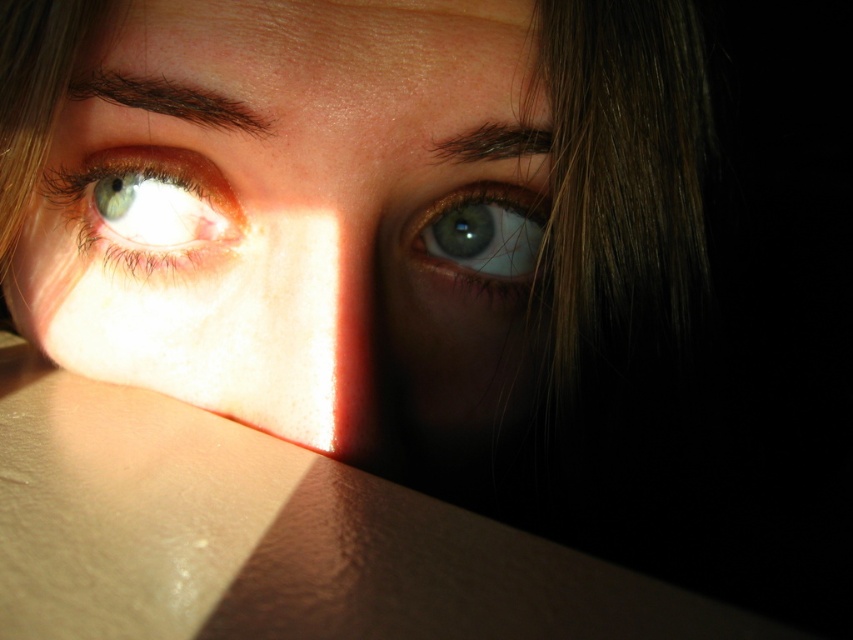
You are a photographer adjusting the focus on your camera. You need to capture both the smooth skin face at center and the green iridescent eye at upper center in sharp focus. Given that the depth of field allows for objects within 2 inches to be in focus, will both objects be in focus?

The smooth skin face at center is 2.53 inches away from the green iridescent eye at upper center. Since the depth of field only allows objects within 2 inches to be in focus, the distance between them exceeds this range. Therefore, both objects cannot be in focus simultaneously.

Based on the scene description, which eye is wider between the green glossy eye at upper left and the green iridescent eye at upper center?

The green glossy eye at upper left might be wider than the green iridescent eye at upper center according to the description.